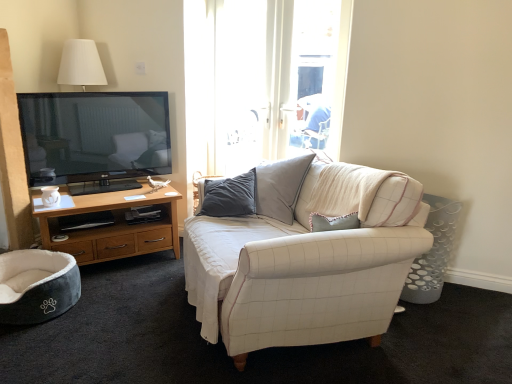
Identify the location of free space in front of wooden cabinet at left. Image resolution: width=512 pixels, height=384 pixels. (114, 309).